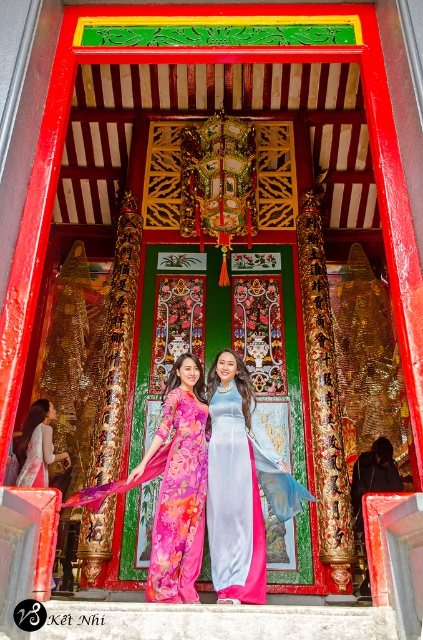
You are a photographer standing at the entrance of the temple. You want to take a photo of the silky blue dress at center. Where should you position your camera to capture the dress perfectly?

To capture the silky blue dress at center perfectly, position your camera directly facing the center of the doorway where the silky blue dress at center is located at coordinates approximately 0.787 on the x axis and 0.553 on the y axis.

You are a photographer standing at the entrance of the temple. You want to take a photo that includes both the floral silk dress at center and the pink silk ao dai at center. Given that your camera has a maximum focus range of 15 meters, will you be able to capture both subjects in focus?

The distance between the floral silk dress at center and the pink silk ao dai at center is 15.89 meters, which exceeds the camera maximum focus range of 15 meters. Therefore, you cannot capture both subjects in focus.